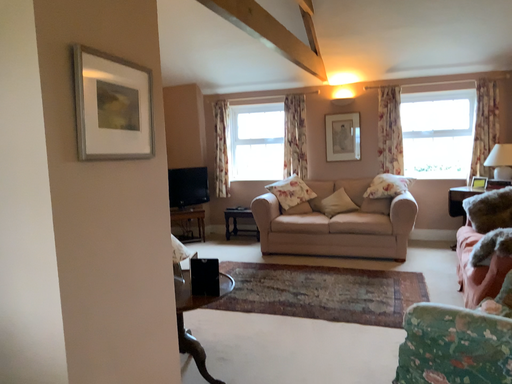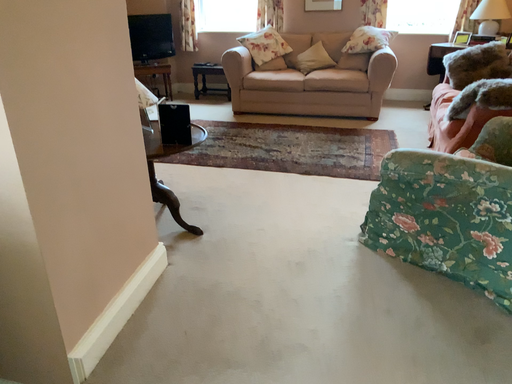
Question: Which way did the camera rotate in the video?

Choices:
 (A) rotated upward
 (B) rotated downward

Answer: (B)